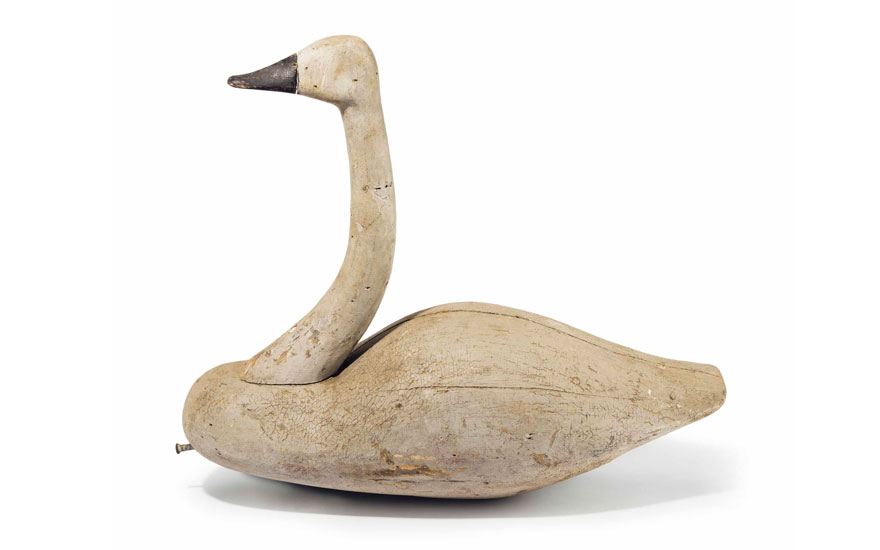
What are the coordinates of `empty space at top right corner` in the screenshot? It's located at (738, 4).